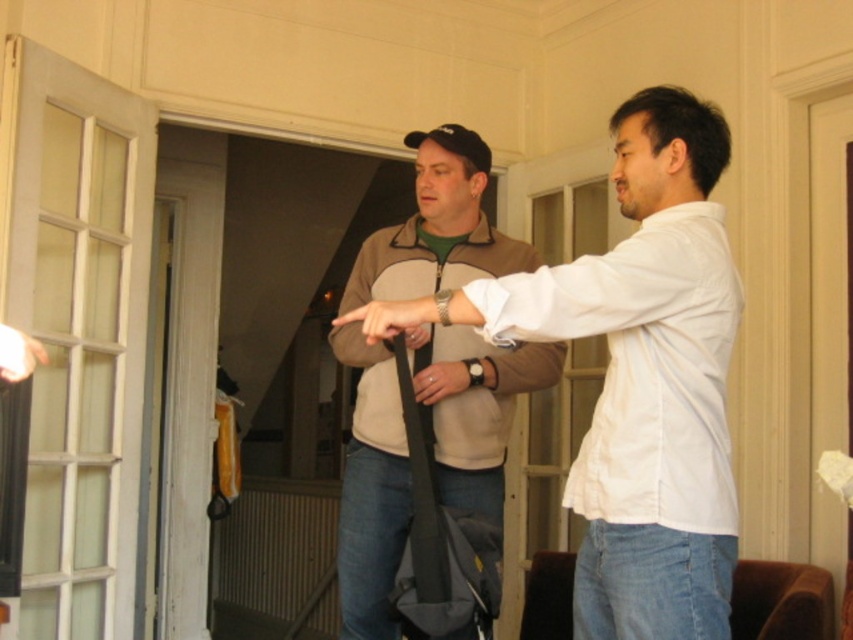
Which is above, white matte hand at upper left or matte black bag at center?

Positioned higher is white matte hand at upper left.

Can you confirm if white matte hand at upper left is smaller than matte black bag at center?

Incorrect, white matte hand at upper left is not smaller in size than matte black bag at center.

Image resolution: width=853 pixels, height=640 pixels. What do you see at coordinates (18, 355) in the screenshot? I see `white matte hand at upper left` at bounding box center [18, 355].

Locate an element on the screen. white matte hand at upper left is located at coordinates click(x=18, y=355).

Who is taller, black fabric strap at center or matte black bag at center?

With more height is black fabric strap at center.

Can you confirm if black fabric strap at center is wider than matte black bag at center?

Yes, black fabric strap at center is wider than matte black bag at center.

Between point (430, 548) and point (428, 371), which one is positioned in front?

Point (430, 548)

You are a GUI agent. You are given a task and a screenshot of the screen. Output one action in this format:
    pyautogui.click(x=<x>, y=<y>)
    Task: Click on the black fabric strap at center
    The height and width of the screenshot is (640, 853).
    Given the screenshot: What is the action you would take?
    pyautogui.click(x=440, y=544)

Does matte gray bag at center appear on the left side of black fabric strap at center?

No, matte gray bag at center is not to the left of black fabric strap at center.

Measure the distance from matte gray bag at center to black fabric strap at center.

The distance of matte gray bag at center from black fabric strap at center is 18.92 inches.

The height and width of the screenshot is (640, 853). In order to click on matte gray bag at center in this screenshot , I will do click(643, 378).

Where is `matte gray bag at center`? matte gray bag at center is located at coordinates (643, 378).